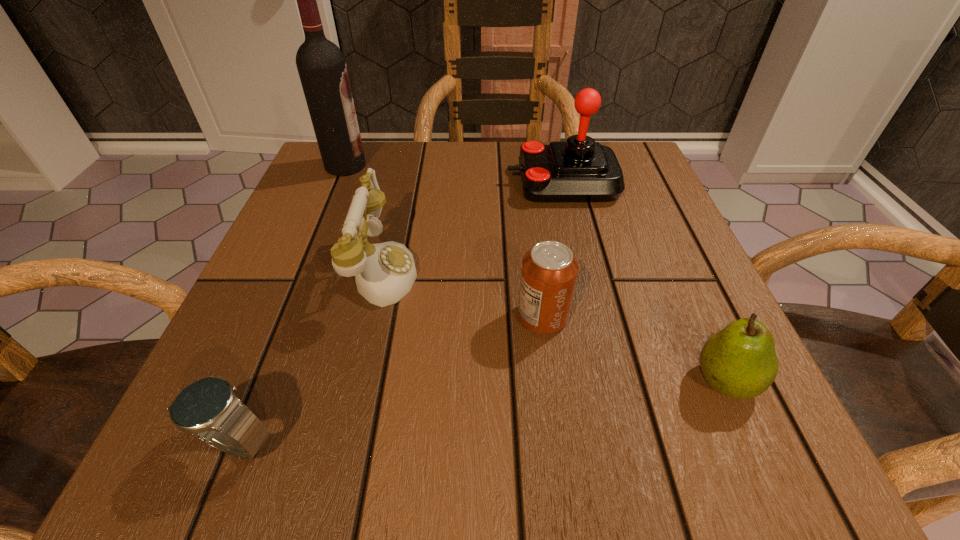
Find the location of a particular element. blank space located on the base of the fifth shortest object is located at coordinates (394, 183).

Find the location of a particular element. vacant space located on the dial of the third object from left to right is located at coordinates (561, 271).

Identify the location of vacant space located on the left of the can. Image resolution: width=960 pixels, height=540 pixels. [478, 317].

Find the location of a particular element. Image resolution: width=960 pixels, height=540 pixels. vacant space located 0.150m on the left of the fifth farthest object is located at coordinates (582, 381).

Image resolution: width=960 pixels, height=540 pixels. In order to click on vacant space situated 0.160m on the right of the shortest object in this screenshot , I will do `click(414, 442)`.

This screenshot has height=540, width=960. I want to click on wine bottle that is positioned at the far edge, so click(x=321, y=65).

Locate an element on the screen. The image size is (960, 540). joystick at the far edge is located at coordinates (579, 169).

I want to click on pear positioned at the near edge, so click(739, 361).

You are a GUI agent. You are given a task and a screenshot of the screen. Output one action in this format:
    pyautogui.click(x=<x>, y=<y>)
    Task: Click on the watch located in the near edge section of the desktop
    The image size is (960, 540).
    Given the screenshot: What is the action you would take?
    [208, 408]

You are a GUI agent. You are given a task and a screenshot of the screen. Output one action in this format:
    pyautogui.click(x=<x>, y=<y>)
    Task: Click on the wine bottle situated at the left edge
    This screenshot has width=960, height=540.
    Given the screenshot: What is the action you would take?
    pyautogui.click(x=321, y=65)